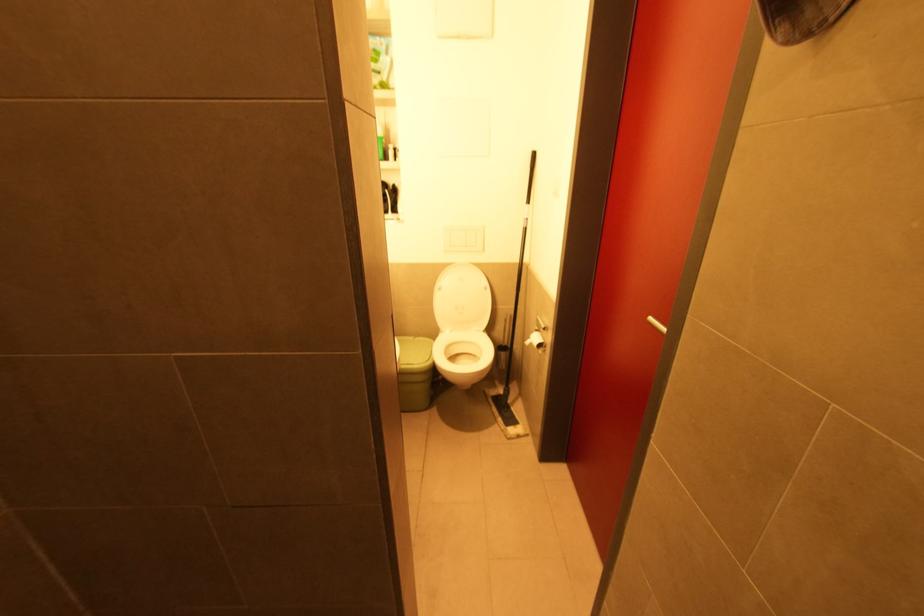
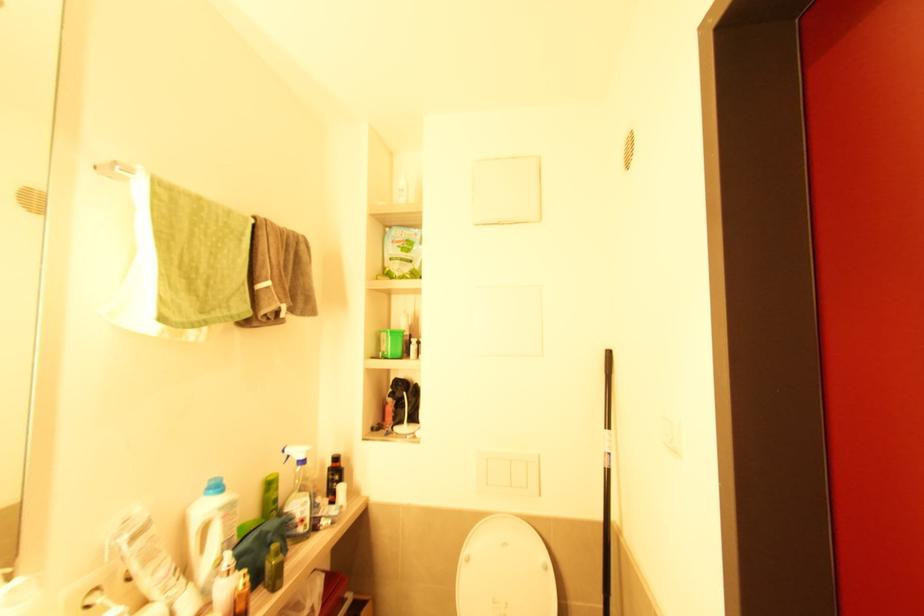
In the second image, find the point that corresponds to pixel 441 290 in the first image.

(469, 561)